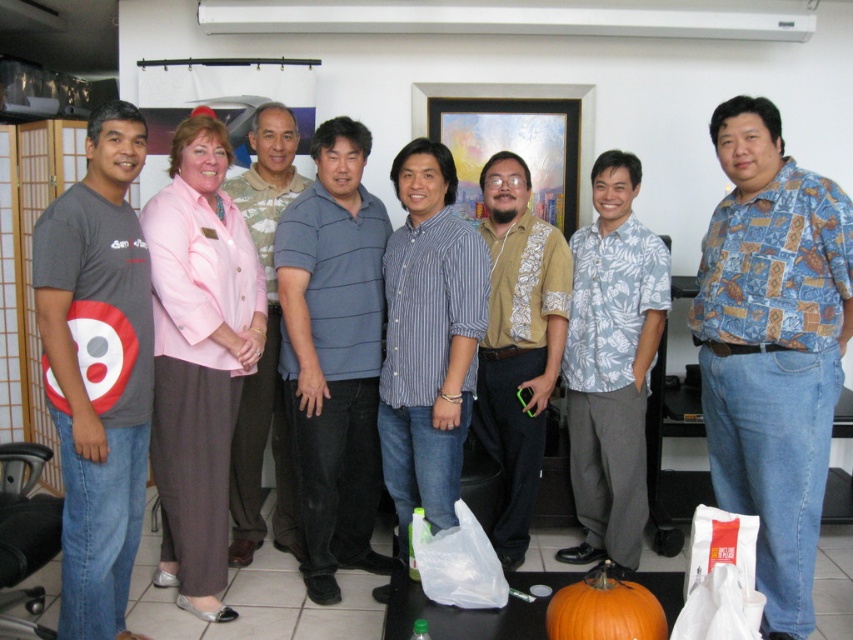
Is blue striped polo shirt at center closer to the viewer compared to light blue shirt at center?

Yes, it is.

Which is in front, point (326, 419) or point (293, 134)?

Positioned in front is point (326, 419).

Find the location of a particular element. The height and width of the screenshot is (640, 853). blue striped polo shirt at center is located at coordinates point(334,355).

Locate an element on the screen. blue striped polo shirt at center is located at coordinates (334, 355).

Between point (57, 394) and point (392, 448), which one is positioned in front?

Point (57, 394)

Does point (38, 285) come in front of point (436, 252)?

Yes, point (38, 285) is closer to viewer.

Who is more distant from viewer, [83,600] or [421,301]?

The point [421,301] is behind.

Find the location of `gray matte t-shirt at left`. gray matte t-shirt at left is located at coordinates (97, 371).

Between light blue floral shirt at center and beige patterned shirt at center, which one is positioned lower?

light blue floral shirt at center is below.

The image size is (853, 640). What do you see at coordinates (611, 364) in the screenshot?
I see `light blue floral shirt at center` at bounding box center [611, 364].

The height and width of the screenshot is (640, 853). I want to click on light blue floral shirt at center, so click(611, 364).